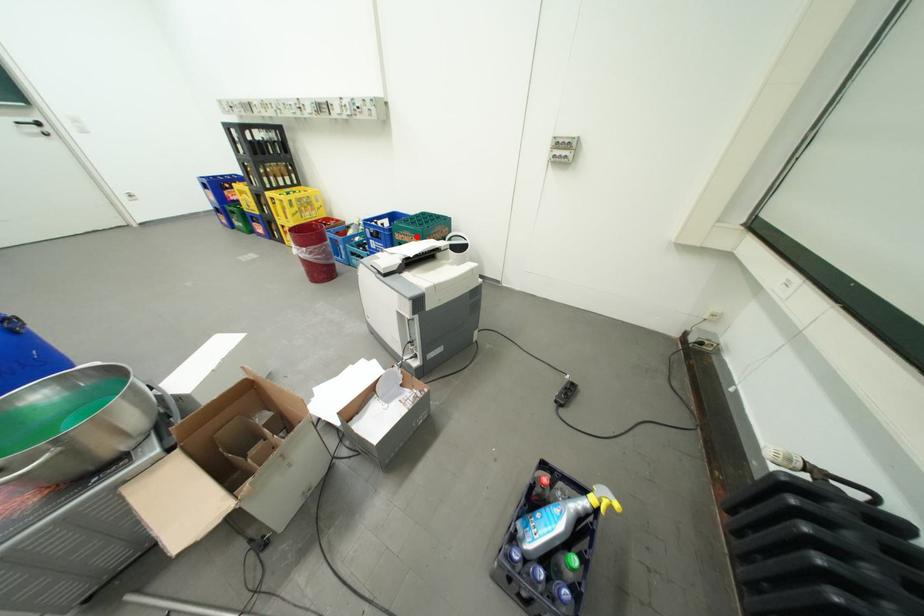
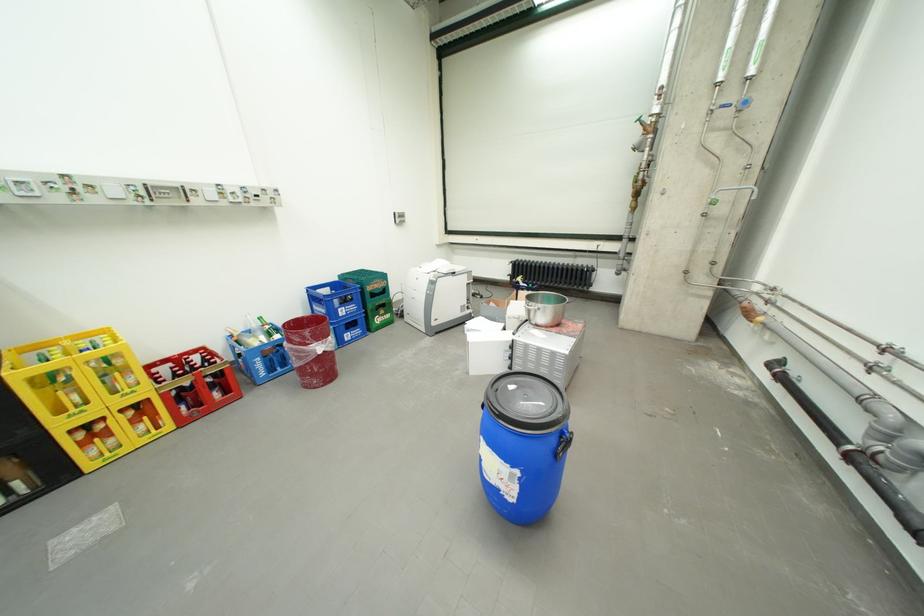
Question: I am providing you with two images of the same scene from different viewpoints. Image1 has a red point marked. In image2, the corresponding 3D location appears at what relative position? Reply with the corresponding letter.

Choices:
 (A) Closer
 (B) Farther

Answer: (A)